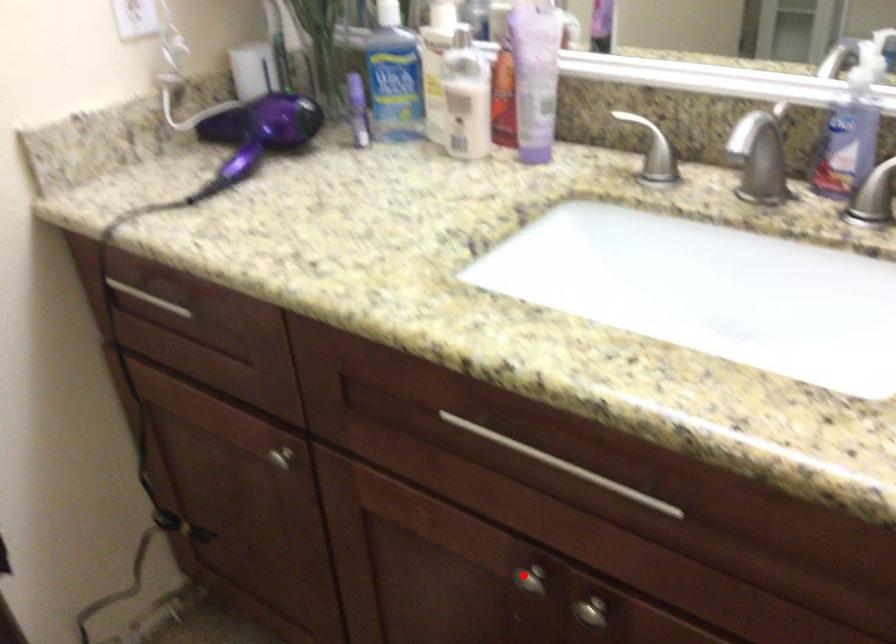
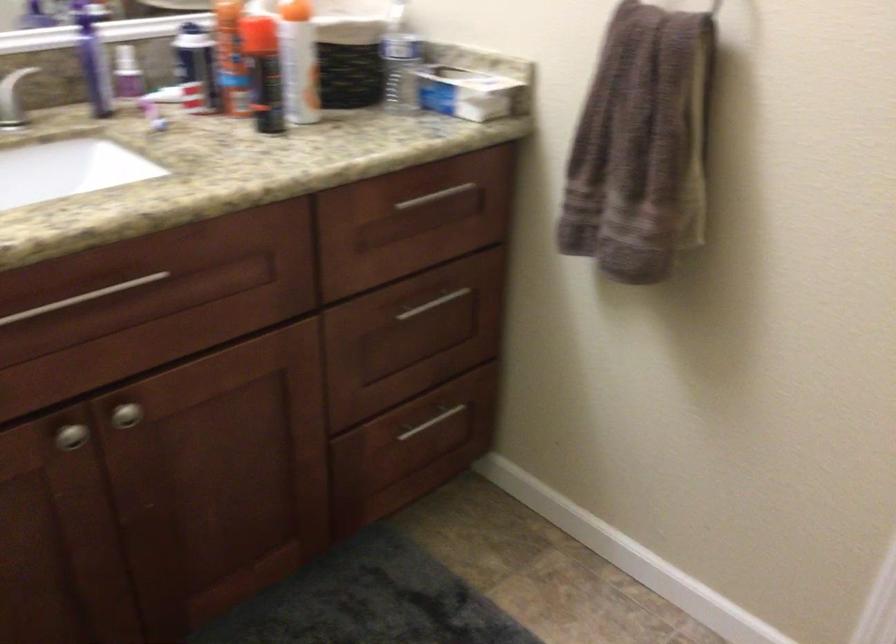
Locate, in the second image, the point that corresponds to the highlighted location in the first image.

(71, 436)